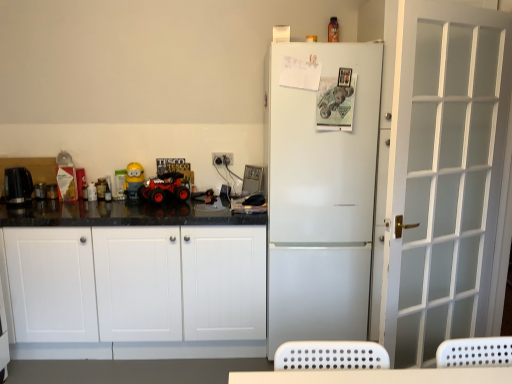
The height and width of the screenshot is (384, 512). What are the coordinates of `free spot below black plastic kettle at left, which appears as the second appliance when viewed from the back (from a real-world perspective)` in the screenshot? It's located at (23, 203).